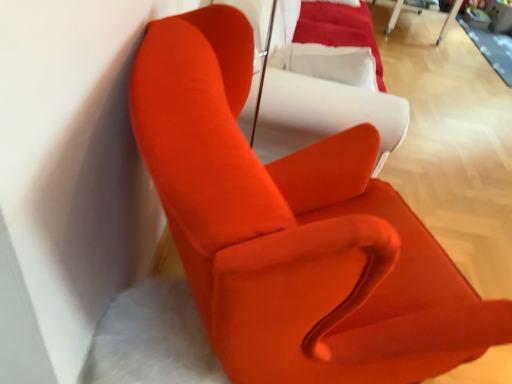
Describe the element at coordinates (323, 114) in the screenshot. The image size is (512, 384). I see `satin white couch at center` at that location.

This screenshot has width=512, height=384. Describe the element at coordinates (398, 14) in the screenshot. I see `white plastic table at upper right` at that location.

Find the location of a particular element. This screenshot has width=512, height=384. satin white couch at center is located at coordinates (323, 114).

From the image's perspective, which is above, satin white couch at center or white plastic table at upper right?

white plastic table at upper right is shown above in the image.

From a real-world perspective, is satin white couch at center located beneath white plastic table at upper right?

Incorrect, from a real-world perspective, satin white couch at center is higher than white plastic table at upper right.

Is satin white couch at center oriented away from white plastic table at upper right?

No, satin white couch at center is not facing away from white plastic table at upper right.

Between matte orange armchair at upper left and white plastic table at upper right, which one appears on the left side from the viewer's perspective?

From the viewer's perspective, matte orange armchair at upper left appears more on the left side.

Does matte orange armchair at upper left contain white plastic table at upper right?

No, white plastic table at upper right is not surrounded by matte orange armchair at upper left.

Is matte orange armchair at upper left smaller than white plastic table at upper right?

Incorrect, matte orange armchair at upper left is not smaller in size than white plastic table at upper right.

Are matte orange armchair at upper left and white plastic table at upper right located far from each other?

That's right, there is a large distance between matte orange armchair at upper left and white plastic table at upper right.

Could you tell me if white plastic table at upper right is facing satin white couch at center?

Yes, white plastic table at upper right is oriented towards satin white couch at center.

Which object is closer to the camera, white plastic table at upper right or satin white couch at center?

satin white couch at center.

Is white plastic table at upper right not inside satin white couch at center?

Absolutely, white plastic table at upper right is external to satin white couch at center.

Find the location of a particular element. couch in front of the white plastic table at upper right is located at coordinates (323, 114).

Is satin white couch at center thinner than matte orange armchair at upper left?

Yes, satin white couch at center is thinner than matte orange armchair at upper left.

How far apart are satin white couch at center and matte orange armchair at upper left?

They are 19.85 inches apart.

Would you consider satin white couch at center to be distant from matte orange armchair at upper left?

satin white couch at center is actually quite close to matte orange armchair at upper left.

Which of these two, white plastic table at upper right or matte orange armchair at upper left, stands shorter?

white plastic table at upper right is shorter.

Is matte orange armchair at upper left located within white plastic table at upper right?

No, matte orange armchair at upper left is not inside white plastic table at upper right.

Is white plastic table at upper right behind matte orange armchair at upper left?

Yes, it is behind matte orange armchair at upper left.

Is white plastic table at upper right smaller than matte orange armchair at upper left?

Yes.

From the image's perspective, would you say matte orange armchair at upper left is positioned over satin white couch at center?

No.

Consider the image. Which is more to the left, matte orange armchair at upper left or satin white couch at center?

From the viewer's perspective, matte orange armchair at upper left appears more on the left side.

From a real-world perspective, is matte orange armchair at upper left above or below satin white couch at center?

Clearly, from a real-world perspective, matte orange armchair at upper left is below satin white couch at center.

Considering the relative sizes of matte orange armchair at upper left and satin white couch at center in the image provided, is matte orange armchair at upper left smaller than satin white couch at center?

No, matte orange armchair at upper left is not smaller than satin white couch at center.

Where is `table located underneath the satin white couch at center (from a real-world perspective)`? table located underneath the satin white couch at center (from a real-world perspective) is located at coordinates (398, 14).

You are a GUI agent. You are given a task and a screenshot of the screen. Output one action in this format:
    pyautogui.click(x=<x>, y=<y>)
    Task: Click on the table on the right of matte orange armchair at upper left
    
    Given the screenshot: What is the action you would take?
    pyautogui.click(x=398, y=14)

When comparing their distances from matte orange armchair at upper left, does satin white couch at center or white plastic table at upper right seem closer?

The object closer to matte orange armchair at upper left is satin white couch at center.

From the image, which object appears to be nearer to matte orange armchair at upper left, white plastic table at upper right or satin white couch at center?

satin white couch at center lies closer to matte orange armchair at upper left than the other object.

Considering their positions, is satin white couch at center positioned closer to white plastic table at upper right than matte orange armchair at upper left?

The object closer to white plastic table at upper right is satin white couch at center.

Looking at the image, which one is located closer to satin white couch at center, white plastic table at upper right or matte orange armchair at upper left?

matte orange armchair at upper left is closer to satin white couch at center.

Looking at the image, which one is located further to satin white couch at center, matte orange armchair at upper left or white plastic table at upper right?

white plastic table at upper right lies further to satin white couch at center than the other object.

Looking at this image, from the image, which object appears to be nearer to white plastic table at upper right, matte orange armchair at upper left or satin white couch at center?

satin white couch at center is closer to white plastic table at upper right.

This screenshot has height=384, width=512. What are the coordinates of `couch between matte orange armchair at upper left and white plastic table at upper right along the z-axis` in the screenshot? It's located at (323, 114).